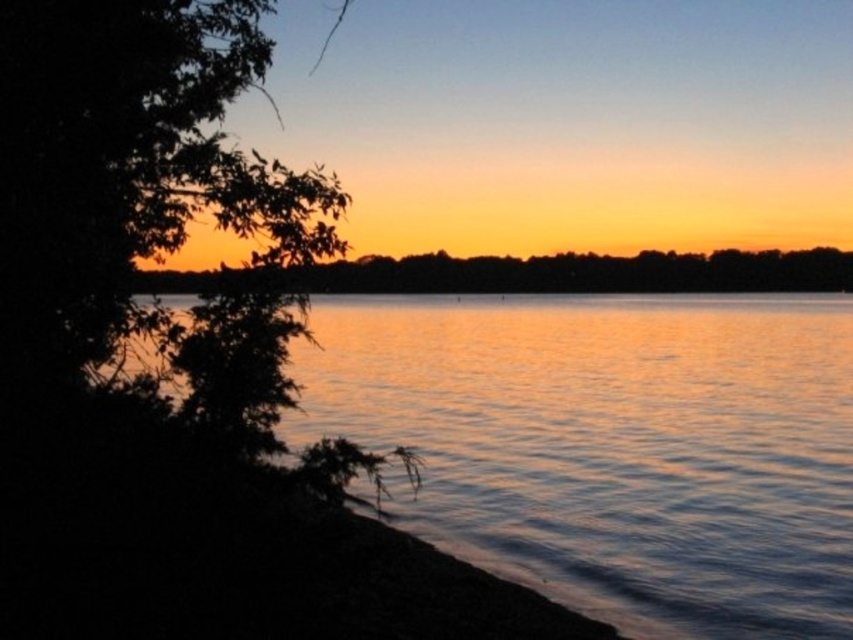
You are a photographer planning to capture the sunset reflection on the water. You notice the shiny reflective water at left and the silhouette tree at center. Which object occupies a wider area in the image?

The shiny reflective water at left occupies a wider area than the silhouette tree at center because its width surpasses the latter.

You are a photographer trying to capture the reflection of the sunset on the water. You see the shiny reflective water at left and the silhouette tree at center. Which object is closer to the right side of the scene?

The shiny reflective water at left is positioned on the right side of silhouette tree at center, so it is closer to the right side of the scene.